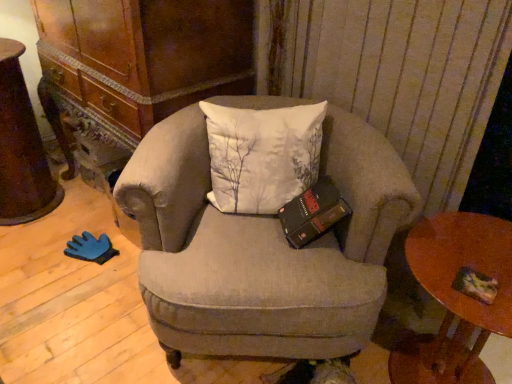
Question: From a real-world perspective, does rustic wood desk at left stand above textured beige armchair at center?

Choices:
 (A) no
 (B) yes

Answer: (B)

Question: Is rustic wood desk at left thinner than textured beige armchair at center?

Choices:
 (A) no
 (B) yes

Answer: (B)

Question: Is rustic wood desk at left far from textured beige armchair at center?

Choices:
 (A) no
 (B) yes

Answer: (B)

Question: Is rustic wood desk at left further to camera compared to textured beige armchair at center?

Choices:
 (A) no
 (B) yes

Answer: (B)

Question: From the image's perspective, is rustic wood desk at left under textured beige armchair at center?

Choices:
 (A) no
 (B) yes

Answer: (A)

Question: Considering the relative sizes of rustic wood desk at left and textured beige armchair at center in the image provided, is rustic wood desk at left taller than textured beige armchair at center?

Choices:
 (A) no
 (B) yes

Answer: (A)

Question: From a real-world perspective, is textured beige armchair at center located higher than wooden round table at lower right?

Choices:
 (A) yes
 (B) no

Answer: (A)

Question: Is textured beige armchair at center oriented towards wooden round table at lower right?

Choices:
 (A) no
 (B) yes

Answer: (A)

Question: Could wooden round table at lower right be considered to be inside textured beige armchair at center?

Choices:
 (A) no
 (B) yes

Answer: (A)

Question: Is textured beige armchair at center further to camera compared to wooden round table at lower right?

Choices:
 (A) no
 (B) yes

Answer: (B)

Question: Does textured beige armchair at center lie in front of wooden round table at lower right?

Choices:
 (A) yes
 (B) no

Answer: (B)

Question: Is textured beige armchair at center shorter than wooden round table at lower right?

Choices:
 (A) yes
 (B) no

Answer: (B)

Question: Is multicolored paper at lower right bigger than wooden round table at lower right?

Choices:
 (A) no
 (B) yes

Answer: (A)